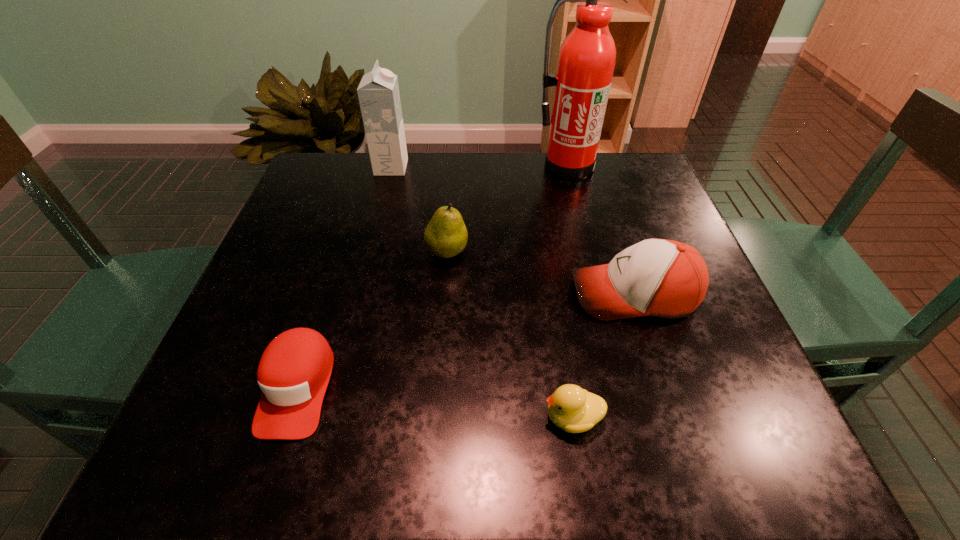
At what (x,y) coordinates should I click in order to perform the action: click on vacant space that satisfies the following two spatial constraints: 1. on the front label of the carton; 2. on the front-facing side of the shorter baseball cap. Please return your answer as a coordinate pair (x, y). Looking at the image, I should click on (335, 387).